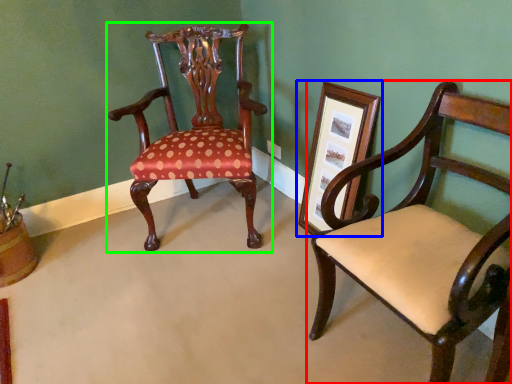
Question: Which object is the closest to the chair (highlighted by a red box)? Choose among these: picture frame (highlighted by a blue box) or chair (highlighted by a green box).

Choices:
 (A) picture frame
 (B) chair

Answer: (A)